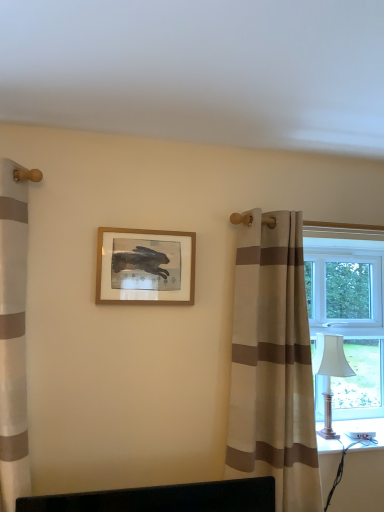
Question: Is wooden picture frame at center outside of silver metallic table lamp at right?

Choices:
 (A) yes
 (B) no

Answer: (A)

Question: Does wooden picture frame at center have a greater width compared to silver metallic table lamp at right?

Choices:
 (A) yes
 (B) no

Answer: (B)

Question: Considering the relative sizes of wooden picture frame at center and silver metallic table lamp at right in the image provided, is wooden picture frame at center taller than silver metallic table lamp at right?

Choices:
 (A) yes
 (B) no

Answer: (B)

Question: From the image's perspective, is wooden picture frame at center beneath silver metallic table lamp at right?

Choices:
 (A) yes
 (B) no

Answer: (B)

Question: Is wooden picture frame at center smaller than silver metallic table lamp at right?

Choices:
 (A) no
 (B) yes

Answer: (B)

Question: Are wooden picture frame at center and silver metallic table lamp at right located far from each other?

Choices:
 (A) no
 (B) yes

Answer: (A)

Question: From the image's perspective, is beige striped curtain at right beneath white plastic window at right?

Choices:
 (A) yes
 (B) no

Answer: (A)

Question: Can you confirm if beige striped curtain at right is positioned to the right of white plastic window at right?

Choices:
 (A) no
 (B) yes

Answer: (A)

Question: Can you confirm if beige striped curtain at right is taller than white plastic window at right?

Choices:
 (A) yes
 (B) no

Answer: (A)

Question: Can you confirm if beige striped curtain at right is wider than white plastic window at right?

Choices:
 (A) no
 (B) yes

Answer: (B)

Question: Is beige striped curtain at right at the left side of white plastic window at right?

Choices:
 (A) yes
 (B) no

Answer: (A)

Question: Considering the relative sizes of beige striped curtain at right and white plastic window at right in the image provided, is beige striped curtain at right smaller than white plastic window at right?

Choices:
 (A) yes
 (B) no

Answer: (B)

Question: Is there a large distance between wooden picture frame at center and beige striped curtain at right?

Choices:
 (A) yes
 (B) no

Answer: (B)